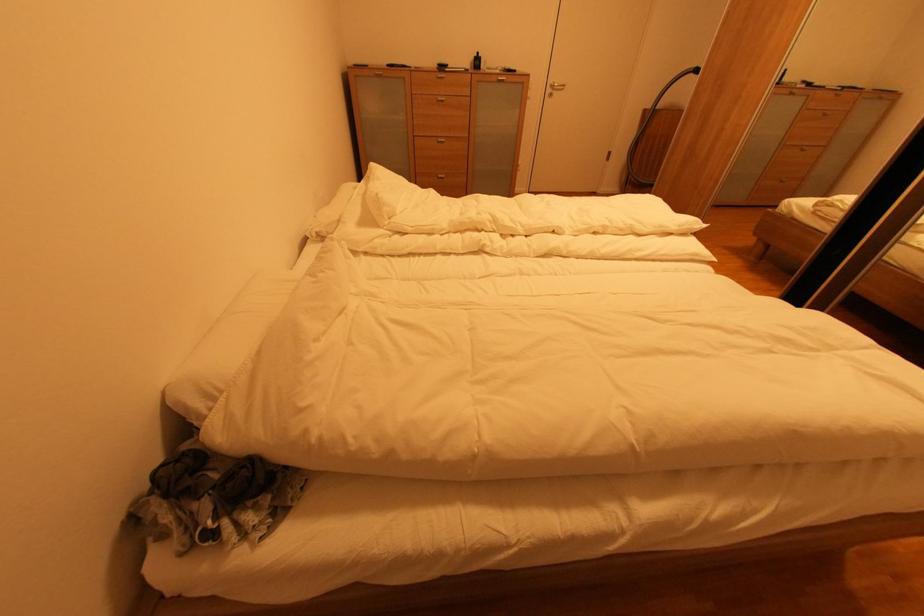
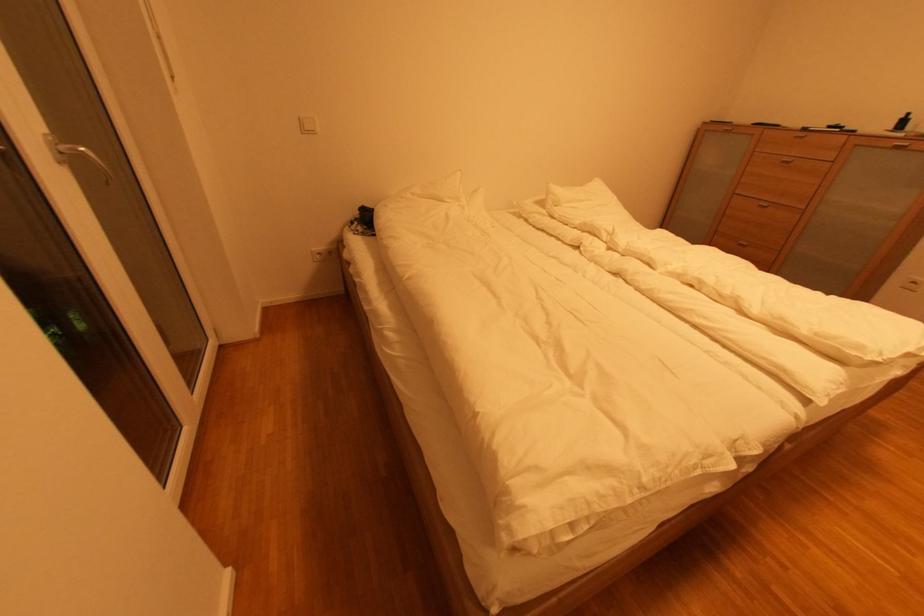
The point at (481, 55) is marked in the first image. Where is the corresponding point in the second image?

(908, 118)